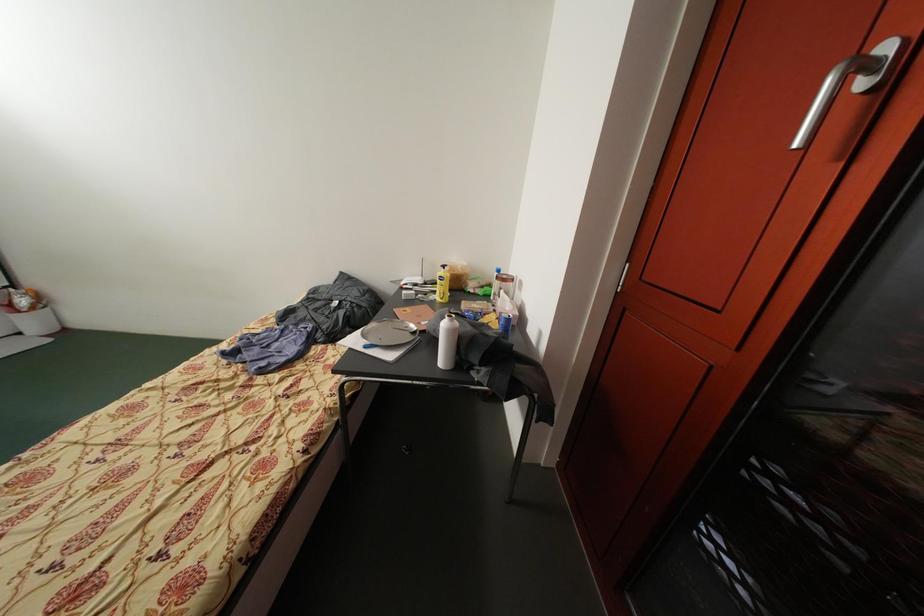
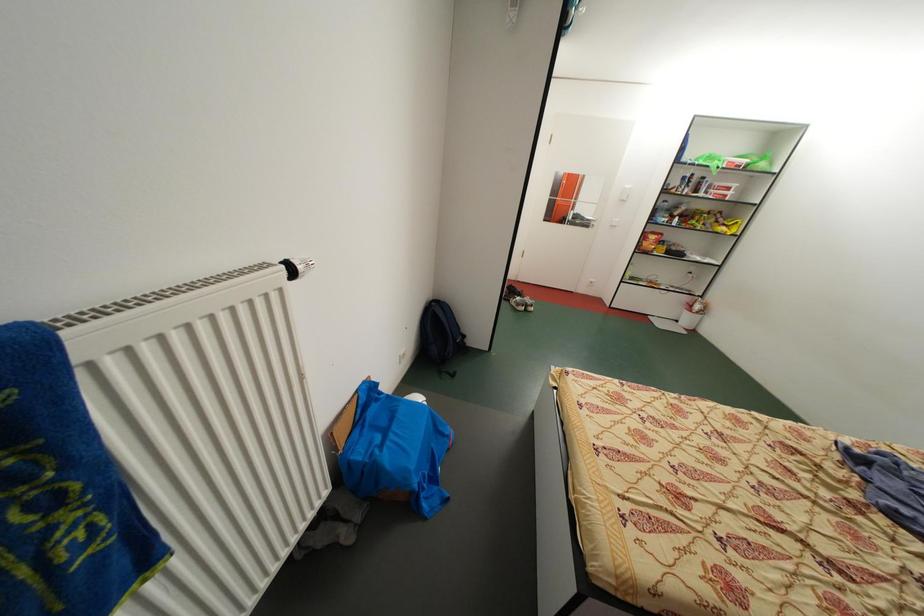
The first image is from the beginning of the video and the second image is from the end. How did the camera likely rotate when shooting the video?

The camera's rotation is toward left-down.